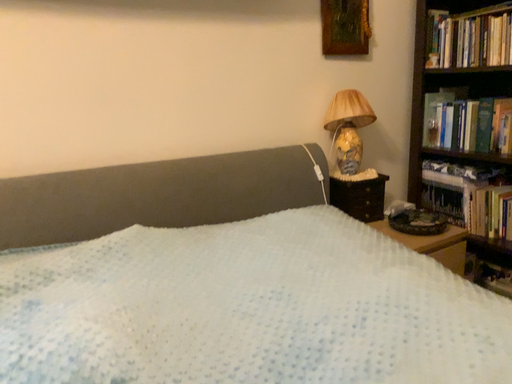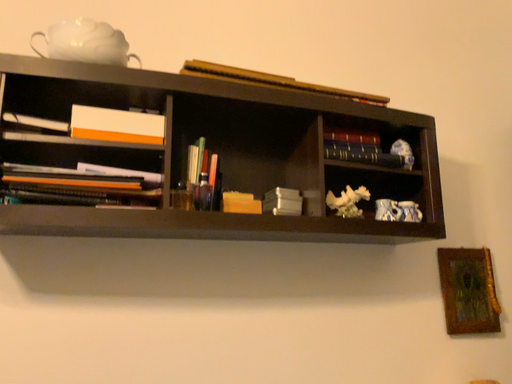
Question: How did the camera likely rotate when shooting the video?

Choices:
 (A) rotated downward
 (B) rotated upward

Answer: (B)